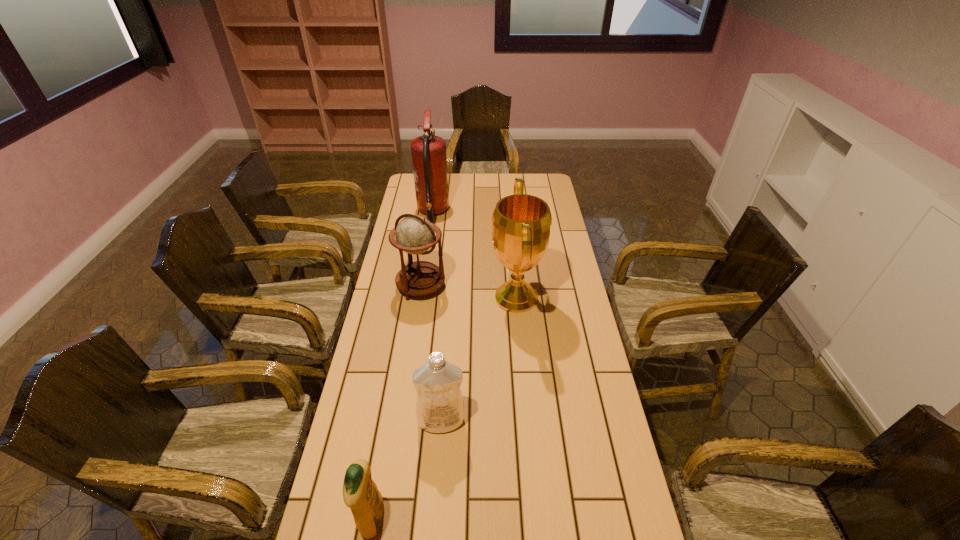
Locate an element on the screen. Image resolution: width=960 pixels, height=540 pixels. the farthest object is located at coordinates (429, 160).

I want to click on the rightmost object, so click(521, 223).

You are a GUI agent. You are given a task and a screenshot of the screen. Output one action in this format:
    pyautogui.click(x=<x>, y=<y>)
    Task: Click on the third shortest object
    The image size is (960, 540).
    Given the screenshot: What is the action you would take?
    pyautogui.click(x=414, y=234)

Where is `the farther detergent`? The height and width of the screenshot is (540, 960). the farther detergent is located at coordinates (439, 404).

Locate an element on the screen. This screenshot has height=540, width=960. the right detergent is located at coordinates (439, 404).

The image size is (960, 540). I want to click on vacant space located 0.110m at the front of the fire extinguisher where the nozzle is aimed, so click(x=472, y=212).

The image size is (960, 540). I want to click on free space located on the front-facing side of the rightmost object, so click(428, 298).

Identify the location of free space located on the front-facing side of the rightmost object. (405, 298).

Where is `vacant space located on the front-facing side of the rightmost object`? Image resolution: width=960 pixels, height=540 pixels. vacant space located on the front-facing side of the rightmost object is located at coordinates (394, 298).

At what (x,y) coordinates should I click in order to perform the action: click on vacant space situated 0.290m on the surface of the globe. Please return your answer as a coordinate pair (x, y). Looking at the image, I should click on (409, 367).